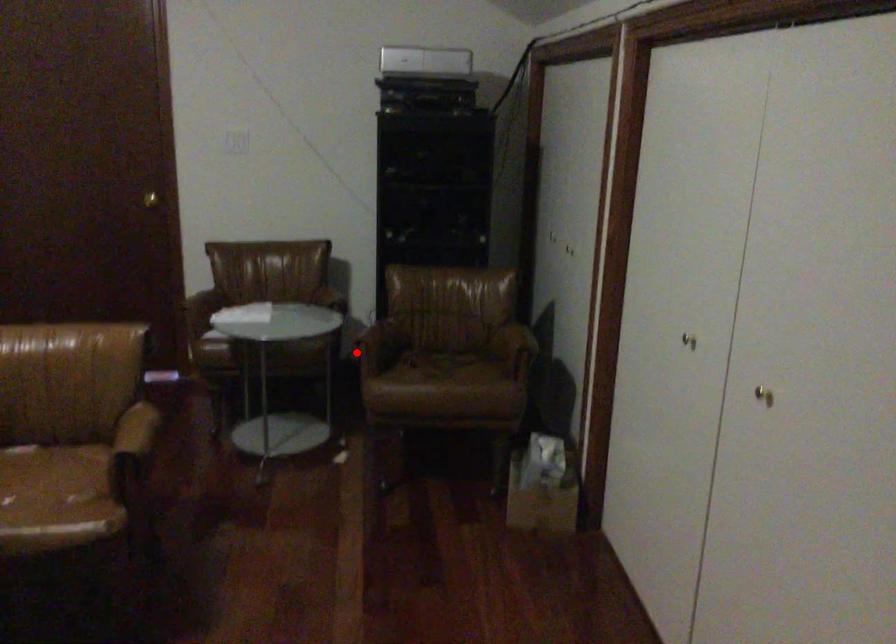
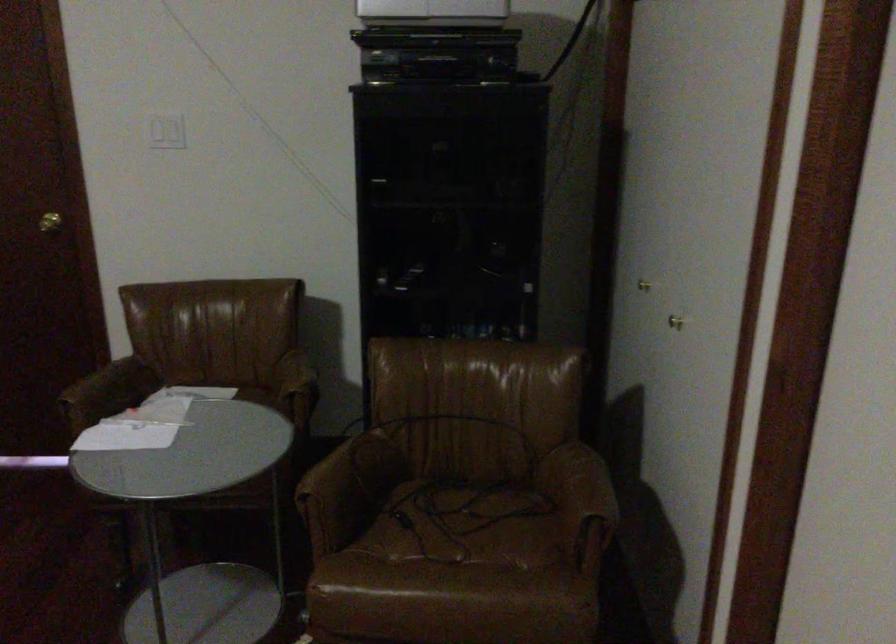
In the second image, find the point that corresponds to the highlighted location in the first image.

(312, 513)